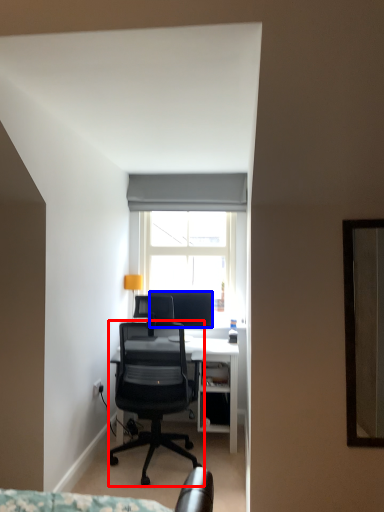
Question: Which point is further to the camera, chair (highlighted by a red box) or television (highlighted by a blue box)?

Choices:
 (A) chair
 (B) television

Answer: (B)